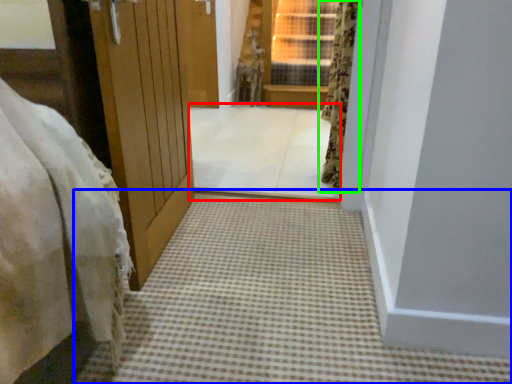
Question: Based on their relative distances, which object is farther from passage (highlighted by a red box)? Choose from path (highlighted by a blue box) and curtain (highlighted by a green box).

Choices:
 (A) path
 (B) curtain

Answer: (A)